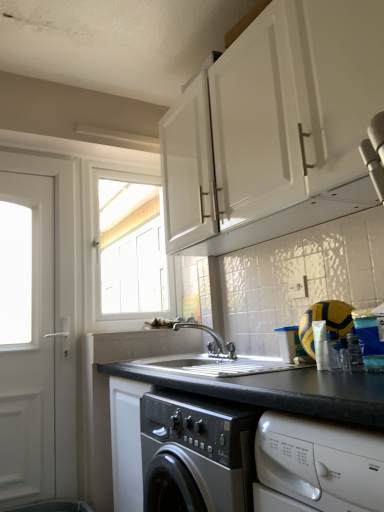
Question: Is black granite countertop at center wider or thinner than white glossy window at upper center?

Choices:
 (A) wide
 (B) thin

Answer: (A)

Question: Considering the positions of black granite countertop at center and white glossy window at upper center in the image, is black granite countertop at center taller or shorter than white glossy window at upper center?

Choices:
 (A) short
 (B) tall

Answer: (A)

Question: Which of these objects is positioned closest to the black granite countertop at center?

Choices:
 (A) silver metallic faucet at center
 (B) white matte door at left
 (C) white glossy window at upper center
 (D) white matte cabinet at upper center

Answer: (A)

Question: Considering the real-world distances, which object is farthest from the white matte cabinet at upper center?

Choices:
 (A) black granite countertop at center
 (B) silver metallic faucet at center
 (C) white glossy window at upper center
 (D) white matte door at left

Answer: (C)